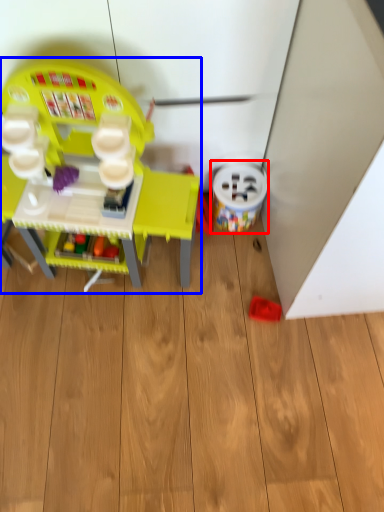
Question: Which point is further to the camera, toy (highlighted by a red box) or toy (highlighted by a blue box)?

Choices:
 (A) toy
 (B) toy

Answer: (A)